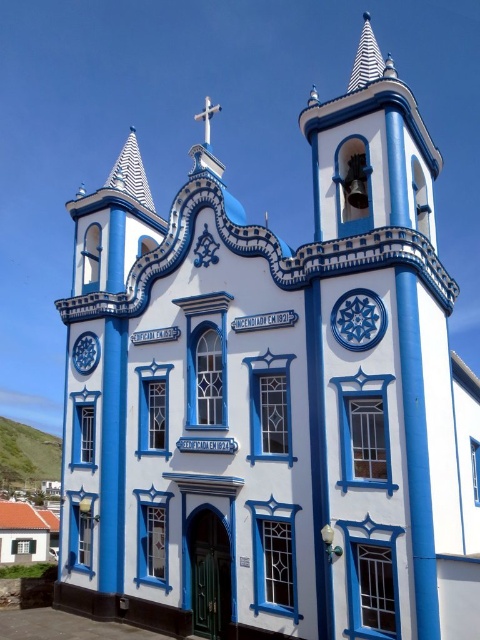
You are an architect visiting this ornate church and want to install a new decorative element between the blue glossy clock at center and the white striped spire at upper left. The element requires a minimum of 80 feet of space between them. Based on the current distance, is this feasible?

The blue glossy clock at center and white striped spire at upper left are 78.82 feet apart from each other. Since the required space is 80 feet, the distance is insufficient by 1.18 feet, making it unfeasible to install the decorative element.

You are standing in front of the ornate church and want to take a photo. There are two points marked on the church facade at coordinates point [360,323] and point [134,182]. Which point should you focus on to ensure it appears closer in your photo?

Point [360,323] is closer to the camera than point [134,182], so focusing on point [360,323] will make it appear closer in the photo.